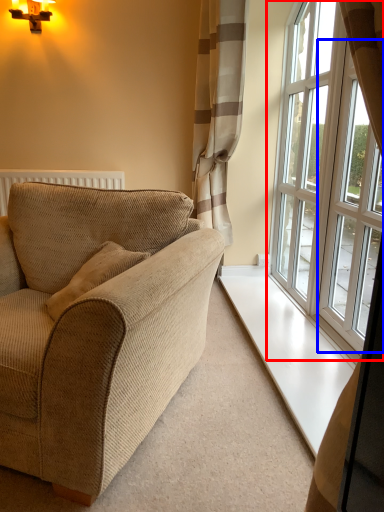
Question: Among these objects, which one is nearest to the camera, window (highlighted by a red box) or window (highlighted by a blue box)?

Choices:
 (A) window
 (B) window

Answer: (B)